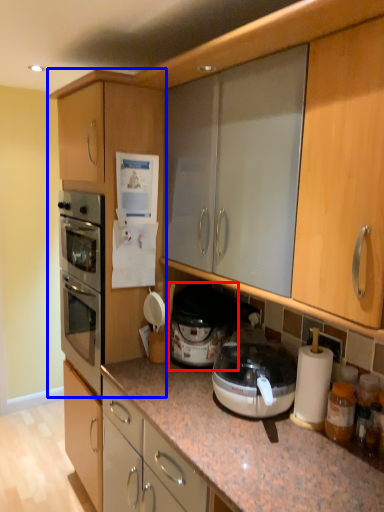
Question: Among these objects, which one is nearest to the camera, cooker (highlighted by a red box) or cabinetry (highlighted by a blue box)?

Choices:
 (A) cooker
 (B) cabinetry

Answer: (B)